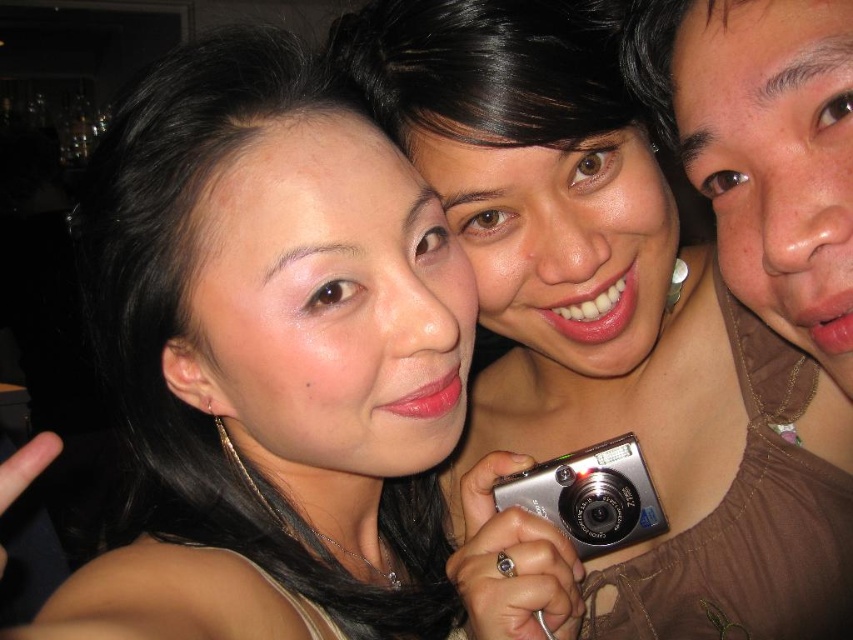
You are a photographer trying to adjust the lighting for a portrait. You notice the matte brown shirt at right and the silver metallic camera at center in your frame. Which object should you focus the light on to ensure it reflects more light?

The silver metallic camera at center should be focused on because silver metallic surfaces reflect more light than matte brown materials.

You are a photographer trying to focus on the person in the middle who is holding the camera. You notice two points in the image at coordinates point (322, 637) and point (605, 467). Which point should you focus on to ensure the person in the middle is sharp?

You should focus on point (322, 637) because it is closer to the camera than point (605, 467), which would help in capturing the person in the middle more sharply.

You are a photographer trying to adjust the lighting for a group photo. You notice the matte black hair at upper center and the matte brown shirt at right. Which object should you focus on to ensure proper exposure since it is closer to the camera?

The matte black hair at upper center is positioned under the matte brown shirt at right, so it is closer to the camera. Therefore, focusing on the matte black hair at upper center will ensure proper exposure.